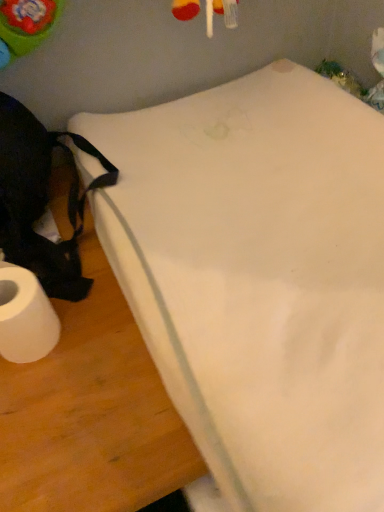
The height and width of the screenshot is (512, 384). Find the location of `free location to the right of white matte toilet paper at lower left`. free location to the right of white matte toilet paper at lower left is located at coordinates (104, 349).